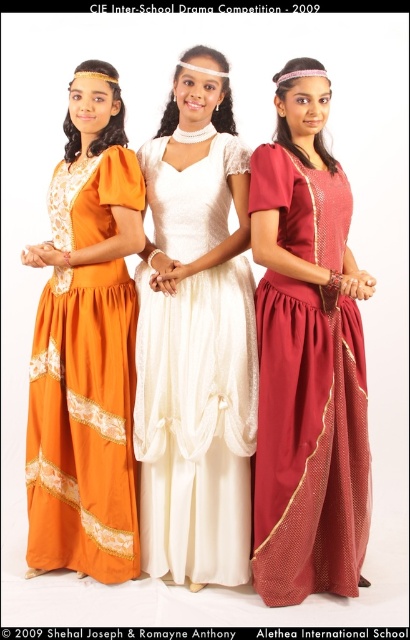
You are a photographer at the CIE Inter School Drama Competition 2009. You need to adjust the lighting to highlight the texture of the dresses. Which dress should you focus on if you want to emphasize the smooth and shiny fabric? Please choose between the matte red dress at center and the white satin dress at center.

The white satin dress at center has a shiny fabric, so you should focus on it to emphasize the smooth and shiny texture.

You are a photographer at the CIE Inter School Drama Competition 2009. You need to capture a clear photo of the white satin dress at center and orange lace dress at left. Which dress is closer to you?

The white satin dress at center is closer to you because it is positioned over the orange lace dress at left, indicating it is in front.